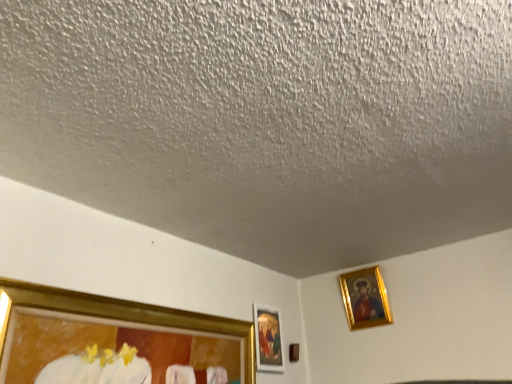
Question: Is gold metallic picture frame at upper right, positioned as the 1th picture frame in right-to-left order, wider than brown wooden picture frame at lower center, the second picture frame in the left-to-right sequence?

Choices:
 (A) no
 (B) yes

Answer: (B)

Question: Would you consider gold metallic picture frame at upper right, positioned as the third picture frame in left-to-right order, to be distant from brown wooden picture frame at lower center, arranged as the second picture frame when viewed from the right?

Choices:
 (A) yes
 (B) no

Answer: (B)

Question: Is gold metallic picture frame at upper right, positioned as the 1th picture frame in right-to-left order, bigger than brown wooden picture frame at lower center, arranged as the second picture frame when viewed from the right?

Choices:
 (A) no
 (B) yes

Answer: (B)

Question: From a real-world perspective, is gold metallic picture frame at upper right, positioned as the third picture frame in left-to-right order, below brown wooden picture frame at lower center, the second picture frame in the left-to-right sequence?

Choices:
 (A) no
 (B) yes

Answer: (A)

Question: From the image's perspective, is gold metallic picture frame at upper right, positioned as the 1th picture frame in right-to-left order, under brown wooden picture frame at lower center, arranged as the second picture frame when viewed from the right?

Choices:
 (A) yes
 (B) no

Answer: (B)

Question: Looking at their shapes, would you say gold metallic picture frame at upper right, positioned as the third picture frame in left-to-right order, is wider or thinner than brown wooden picture frame at lower center, arranged as the second picture frame when viewed from the right?

Choices:
 (A) wide
 (B) thin

Answer: (A)

Question: Does point (379, 274) appear closer or farther from the camera than point (296, 344)?

Choices:
 (A) farther
 (B) closer

Answer: (B)

Question: Is gold metallic picture frame at upper right, positioned as the third picture frame in left-to-right order, taller or shorter than brown wooden picture frame at lower center, the second picture frame in the left-to-right sequence?

Choices:
 (A) tall
 (B) short

Answer: (A)

Question: Looking at the image, does gold metallic picture frame at upper right, positioned as the third picture frame in left-to-right order, seem bigger or smaller compared to brown wooden picture frame at lower center, the second picture frame in the left-to-right sequence?

Choices:
 (A) big
 (B) small

Answer: (A)

Question: Which is correct: gold-framed painting at center, which ranks as the third picture frame in right-to-left order, is inside brown wooden picture frame at lower center, arranged as the second picture frame when viewed from the right, or outside of it?

Choices:
 (A) inside
 (B) outside

Answer: (B)

Question: Considering the positions of gold-framed painting at center, which ranks as the third picture frame in right-to-left order, and brown wooden picture frame at lower center, the second picture frame in the left-to-right sequence, in the image, is gold-framed painting at center, which ranks as the third picture frame in right-to-left order, bigger or smaller than brown wooden picture frame at lower center, the second picture frame in the left-to-right sequence,?

Choices:
 (A) big
 (B) small

Answer: (A)

Question: Is point (268, 316) positioned closer to the camera than point (291, 342)?

Choices:
 (A) farther
 (B) closer

Answer: (B)

Question: In terms of width, does gold-framed painting at center, which ranks as the third picture frame in right-to-left order, look wider or thinner when compared to brown wooden picture frame at lower center, the second picture frame in the left-to-right sequence?

Choices:
 (A) wide
 (B) thin

Answer: (A)

Question: Is gold metallic picture frame at upper right, positioned as the 1th picture frame in right-to-left order, in front of or behind gold-framed painting at center, which ranks as the third picture frame in right-to-left order, in the image?

Choices:
 (A) front
 (B) behind

Answer: (B)

Question: Is gold metallic picture frame at upper right, positioned as the 1th picture frame in right-to-left order, situated inside gold-framed painting at center, which appears as the 1th picture frame when viewed from the left, or outside?

Choices:
 (A) outside
 (B) inside

Answer: (A)